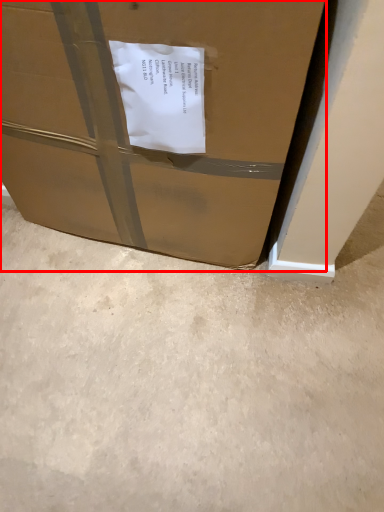
Question: From the image's perspective, what is the correct spatial relationship of box (annotated by the red box) in relation to concrete?

Choices:
 (A) above
 (B) below

Answer: (A)